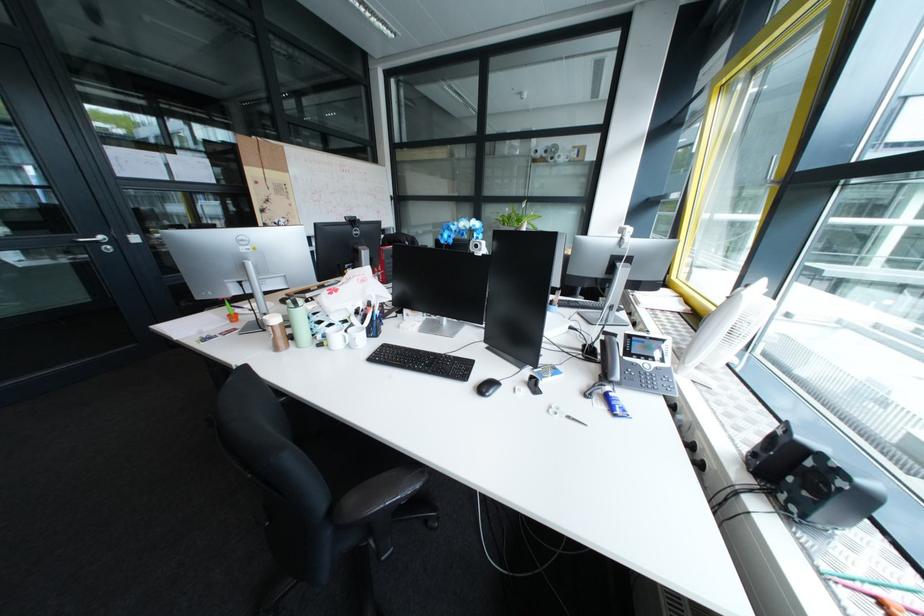
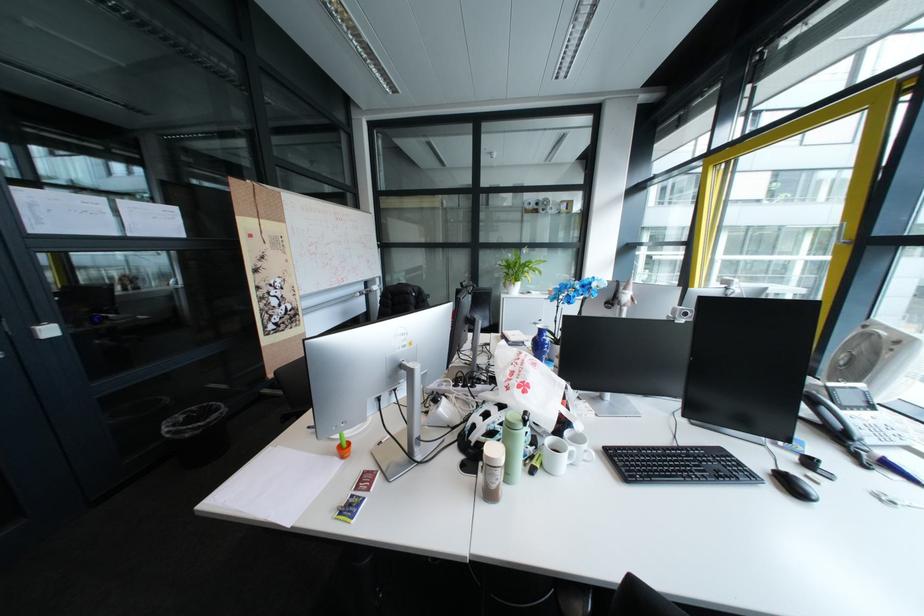
In the second image, find the point that corresponds to point (464, 357) in the first image.

(710, 448)